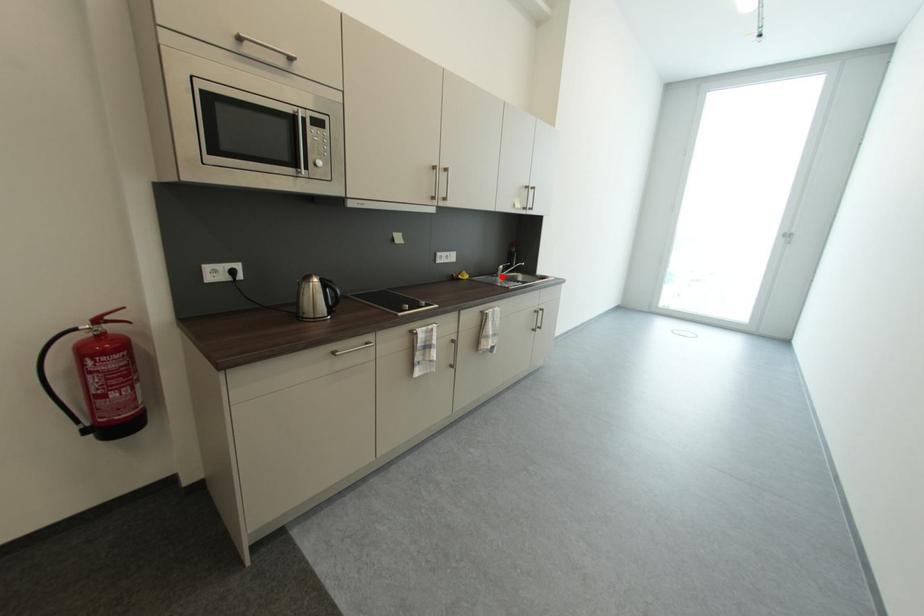
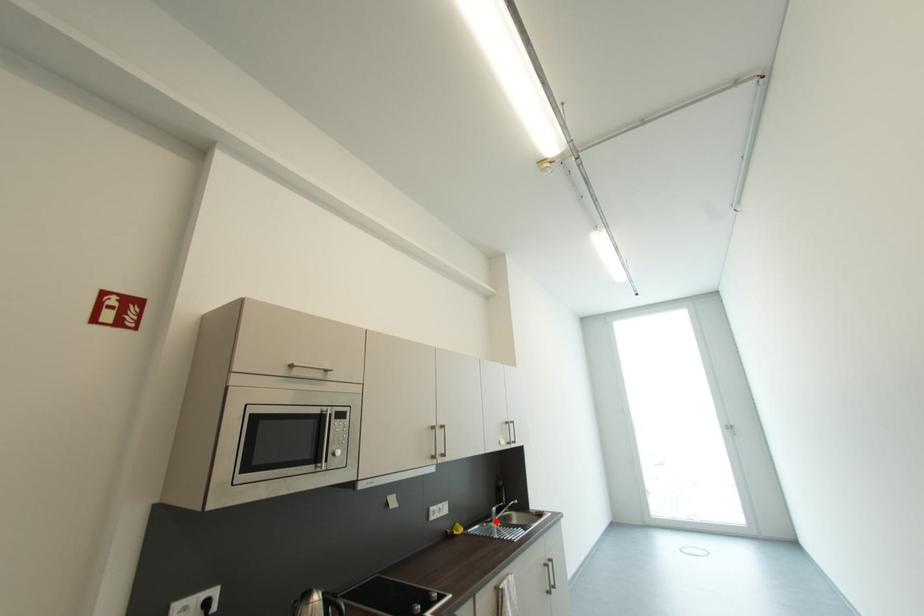
I am providing you with two images of the same scene from different viewpoints. A red point is marked on the first image and another point is marked on the second image. Are the points marked in image1 and image2 representing the same 3D position?

Yes